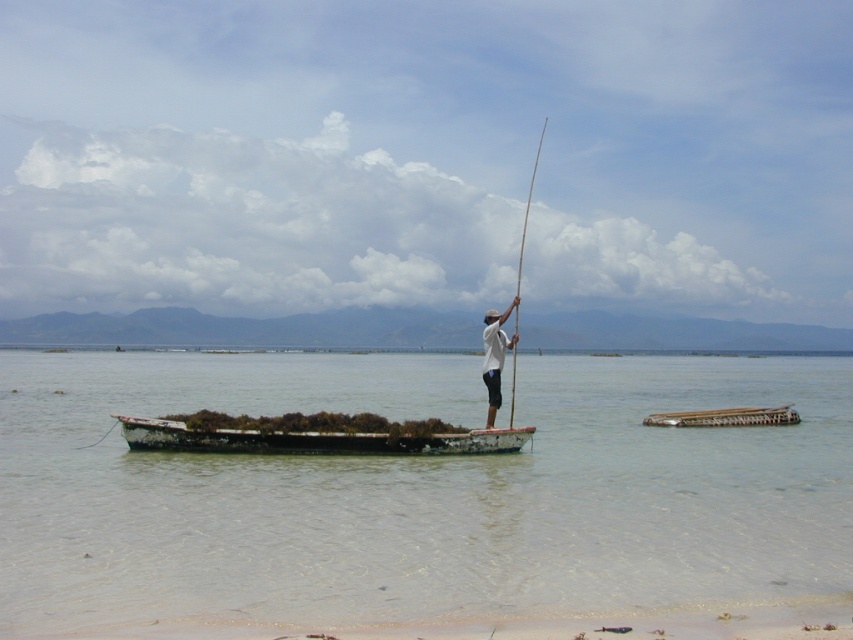
Is point (608, 634) positioned behind point (497, 314)?

No, it is not.

Who is positioned more to the right, sandy beach at lower center or white cotton shirt at center?

From the viewer's perspective, white cotton shirt at center appears more on the right side.

Between point (254, 637) and point (498, 380), which one is positioned in front?

Point (254, 637) is more forward.

The image size is (853, 640). What are the coordinates of `sandy beach at lower center` in the screenshot? It's located at (511, 624).

In the scene shown: Who is shorter, sandy beach at lower center or rusty metal boat at center?

sandy beach at lower center

Between point (814, 602) and point (125, 436), which one is positioned in front?

Positioned in front is point (814, 602).

Does point (599, 616) lie behind point (505, 432)?

No, it is not.

Find the location of `sandy beach at lower center`. sandy beach at lower center is located at coordinates (511, 624).

Can you confirm if sandy beach at lower center is smaller than brown wooden raft at center?

Yes, sandy beach at lower center is smaller than brown wooden raft at center.

Between point (715, 611) and point (697, 419), which one is positioned in front?

Point (715, 611) is more forward.

Locate an element on the screen. This screenshot has height=640, width=853. sandy beach at lower center is located at coordinates (511, 624).